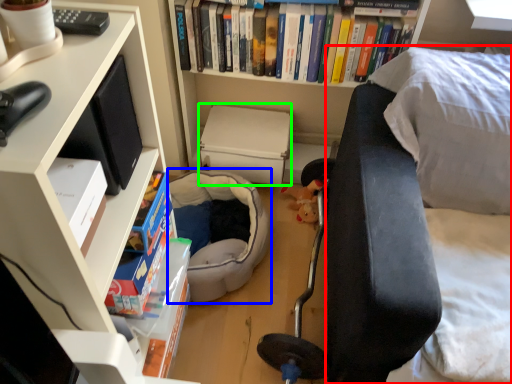
Question: Based on their relative distances, which object is nearer to couch (highlighted by a red box)? Choose from bean bag chair (highlighted by a blue box) and paperback book (highlighted by a green box).

Choices:
 (A) bean bag chair
 (B) paperback book

Answer: (A)